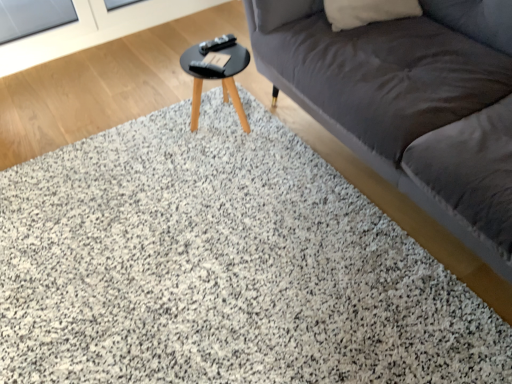
Question: Does black glossy table at center have a larger size compared to white soft pillow at upper right?

Choices:
 (A) yes
 (B) no

Answer: (A)

Question: Is black glossy table at center to the left of white soft pillow at upper right from the viewer's perspective?

Choices:
 (A) no
 (B) yes

Answer: (B)

Question: Does black glossy table at center turn towards white soft pillow at upper right?

Choices:
 (A) yes
 (B) no

Answer: (B)

Question: From a real-world perspective, is black glossy table at center positioned over white soft pillow at upper right based on gravity?

Choices:
 (A) yes
 (B) no

Answer: (B)

Question: Is black glossy table at center closer to the viewer compared to white soft pillow at upper right?

Choices:
 (A) no
 (B) yes

Answer: (B)

Question: From a real-world perspective, is transparent glass screen door at upper left physically located above or below black glossy table at center?

Choices:
 (A) above
 (B) below

Answer: (A)

Question: Considering their positions, is transparent glass screen door at upper left located in front of or behind black glossy table at center?

Choices:
 (A) front
 (B) behind

Answer: (B)

Question: Does point (52, 39) appear closer or farther from the camera than point (237, 97)?

Choices:
 (A) closer
 (B) farther

Answer: (B)

Question: In terms of size, does transparent glass screen door at upper left appear bigger or smaller than black glossy table at center?

Choices:
 (A) small
 (B) big

Answer: (B)

Question: In the image, is white soft pillow at upper right on the left side or the right side of black glossy table at center?

Choices:
 (A) left
 (B) right

Answer: (B)

Question: Relative to black glossy table at center, is white soft pillow at upper right in front or behind?

Choices:
 (A) behind
 (B) front

Answer: (A)

Question: In terms of width, does white soft pillow at upper right look wider or thinner when compared to black glossy table at center?

Choices:
 (A) wide
 (B) thin

Answer: (B)

Question: Does point (373, 19) appear closer or farther from the camera than point (236, 54)?

Choices:
 (A) closer
 (B) farther

Answer: (A)

Question: From the image's perspective, is black glossy table at center above or below transparent glass screen door at upper left?

Choices:
 (A) below
 (B) above

Answer: (A)

Question: In the image, is black glossy table at center on the left side or the right side of transparent glass screen door at upper left?

Choices:
 (A) right
 (B) left

Answer: (A)